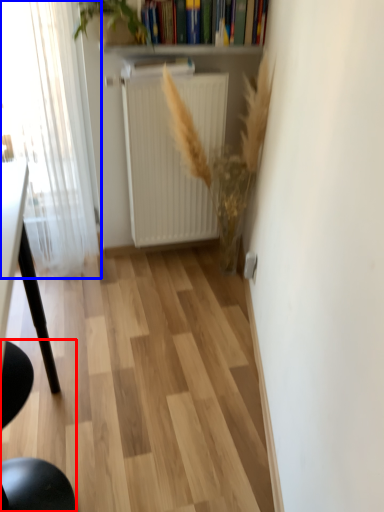
Question: Which object appears farthest to the camera in this image, chair (highlighted by a red box) or window (highlighted by a blue box)?

Choices:
 (A) chair
 (B) window

Answer: (B)